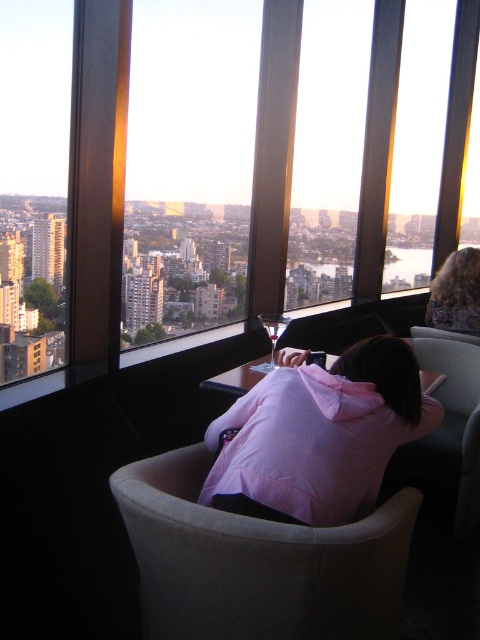
Who is taller, light beige fabric chair at center or transparent glass window at left?

Standing taller between the two is transparent glass window at left.

Who is lower down, light beige fabric chair at center or transparent glass window at left?

Positioned lower is light beige fabric chair at center.

Image resolution: width=480 pixels, height=640 pixels. What are the coordinates of `light beige fabric chair at center` in the screenshot? It's located at (256, 561).

Can you confirm if transparent glass window at left is positioned below dark brown hair at upper right?

Incorrect, transparent glass window at left is not positioned below dark brown hair at upper right.

Between point (59, 40) and point (428, 301), which one is positioned in front?

Point (59, 40)

Where is `transparent glass window at left`? This screenshot has height=640, width=480. transparent glass window at left is located at coordinates (34, 193).

Who is more forward, (223, 456) or (470, 326)?

Point (223, 456) is in front.

Is pink fabric at center below dark brown hair at upper right?

Correct, pink fabric at center is located below dark brown hair at upper right.

Is point (360, 376) less distant than point (447, 259)?

Yes, point (360, 376) is in front of point (447, 259).

Locate an element on the screen. pink fabric at center is located at coordinates (320, 433).